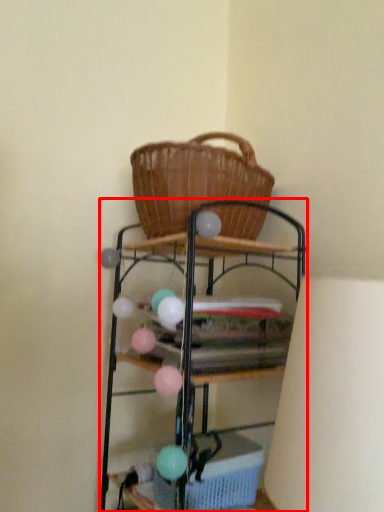
Question: In this image, where is shelf (annotated by the red box) located relative to basket?

Choices:
 (A) right
 (B) left

Answer: (A)